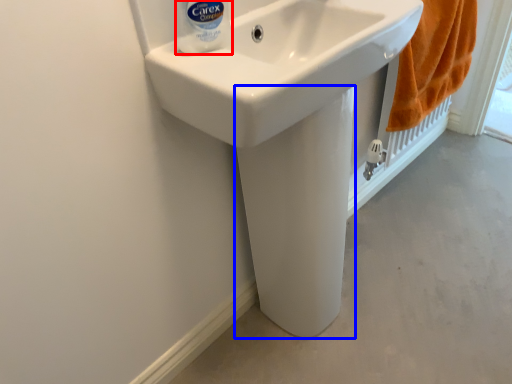
Question: Which point is further to the camera, cleaning product (highlighted by a red box) or bidet (highlighted by a blue box)?

Choices:
 (A) cleaning product
 (B) bidet

Answer: (B)